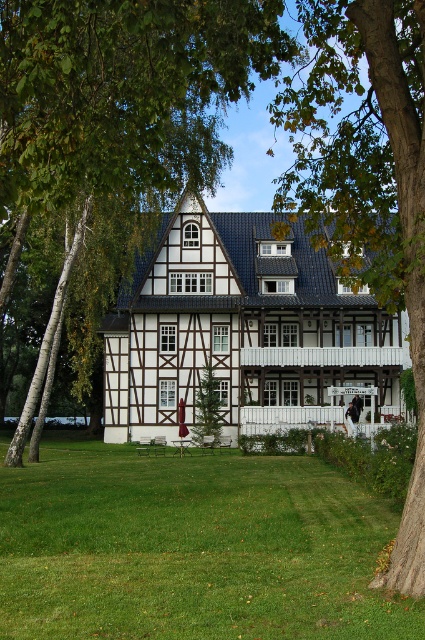
Question: Among these objects, which one is farthest from the camera?

Choices:
 (A) green grass lawn at center
 (B) green leafy tree at center

Answer: (B)

Question: Which of the following is the farthest from the observer?

Choices:
 (A) green grass lawn at center
 (B) smooth bark tree at center
 (C) green leafy tree at center

Answer: (B)

Question: Does green grass lawn at center appear on the left side of green leafy tree at center?

Choices:
 (A) no
 (B) yes

Answer: (A)

Question: Which point is closer to the camera?

Choices:
 (A) (198, 173)
 (B) (354, 3)

Answer: (B)

Question: Is green leafy tree at center smaller than smooth bark tree at center?

Choices:
 (A) no
 (B) yes

Answer: (B)

Question: Is green grass lawn at center positioned before green leafy tree at center?

Choices:
 (A) no
 (B) yes

Answer: (B)